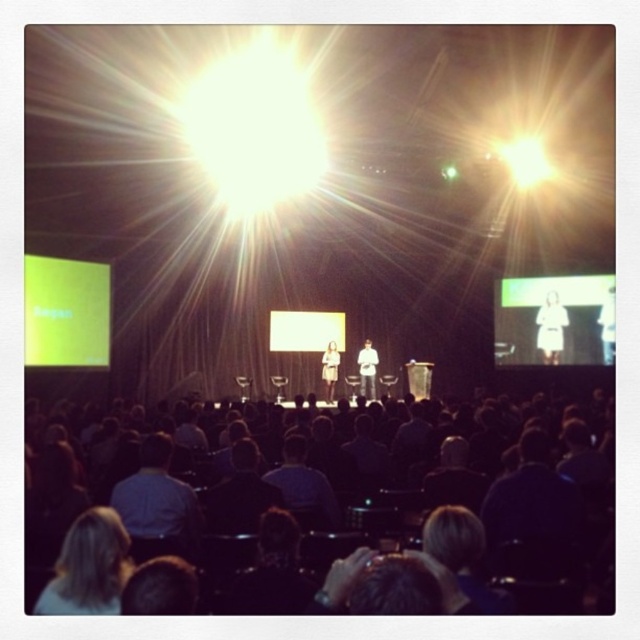
Question: Estimate the real-world distances between objects in this image. Which object is farther from the white glossy projection screen at upper center?

Choices:
 (A) white fabric shirt at center
 (B) white matte projection screen at center

Answer: (B)

Question: From the image, what is the correct spatial relationship of blonde hair at lower left in relation to dark blue shirt at center?

Choices:
 (A) above
 (B) below

Answer: (B)

Question: Which is farther from the dark fabric seats at lower center?

Choices:
 (A) white matte projection screen at center
 (B) blonde hair at lower left
 (C) white fabric dress at center

Answer: (C)

Question: Which point is closer to the camera?

Choices:
 (A) (288, 321)
 (B) (604, 323)
 (C) (330, 348)

Answer: (B)

Question: Where is green matte projection screen at left located in relation to white fabric person at right in the image?

Choices:
 (A) right
 (B) left

Answer: (B)

Question: Does dark fabric seats at lower center have a larger size compared to white fabric person at right?

Choices:
 (A) no
 (B) yes

Answer: (A)